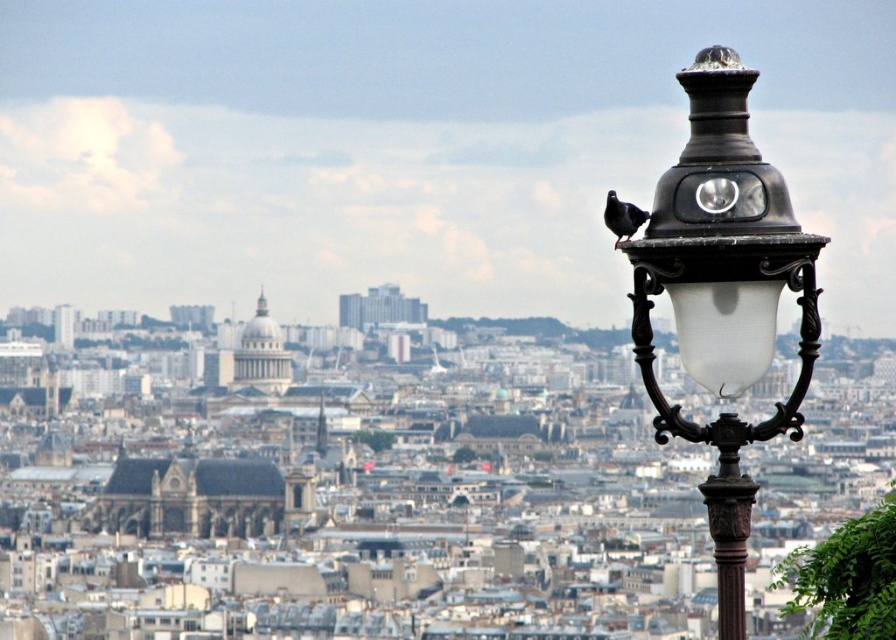
Can you confirm if black metal street light at upper right is positioned above brown polished metal pole at center-right?

Yes.

In the scene shown: Who is lower down, black metal street light at upper right or brown polished metal pole at center-right?

brown polished metal pole at center-right is lower down.

Where is `black metal street light at upper right`? black metal street light at upper right is located at coordinates (721, 292).